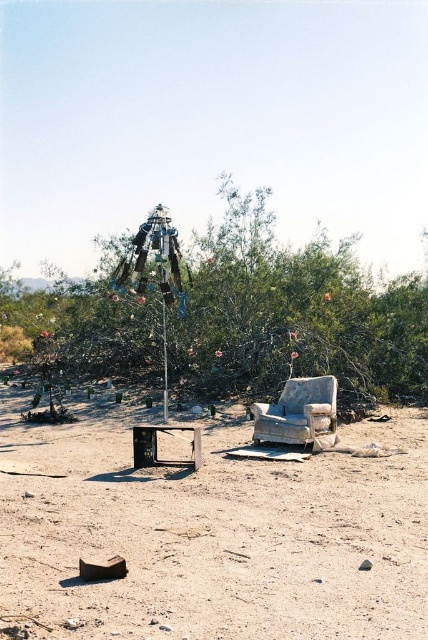
Measure the distance between green leafy tree at center and metallic silver tv at center.

A distance of 31.18 feet exists between green leafy tree at center and metallic silver tv at center.

Which is below, green leafy tree at center or metallic silver tv at center?

metallic silver tv at center is below.

The height and width of the screenshot is (640, 428). Describe the element at coordinates (294, 312) in the screenshot. I see `green leafy tree at center` at that location.

You are a GUI agent. You are given a task and a screenshot of the screen. Output one action in this format:
    pyautogui.click(x=<x>, y=<y>)
    Task: Click on the green leafy tree at center
    This screenshot has height=640, width=428.
    Given the screenshot: What is the action you would take?
    pyautogui.click(x=294, y=312)

Is dusty brown dirt at center smaller than green leafy tree at center?

Yes.

Can you confirm if dusty brown dirt at center is positioned to the left of green leafy tree at center?

Indeed, dusty brown dirt at center is positioned on the left side of green leafy tree at center.

Find the location of `dusty brown dirt at center`. dusty brown dirt at center is located at coordinates (211, 534).

What are the coordinates of `dusty brown dirt at center` in the screenshot? It's located at (211, 534).

Is green leafy tree at center below worn fabric armchair at center?

No, green leafy tree at center is not below worn fabric armchair at center.

Measure the distance between green leafy tree at center and camera.

The distance of green leafy tree at center from camera is 13.77 meters.

This screenshot has height=640, width=428. I want to click on green leafy tree at center, so click(x=294, y=312).